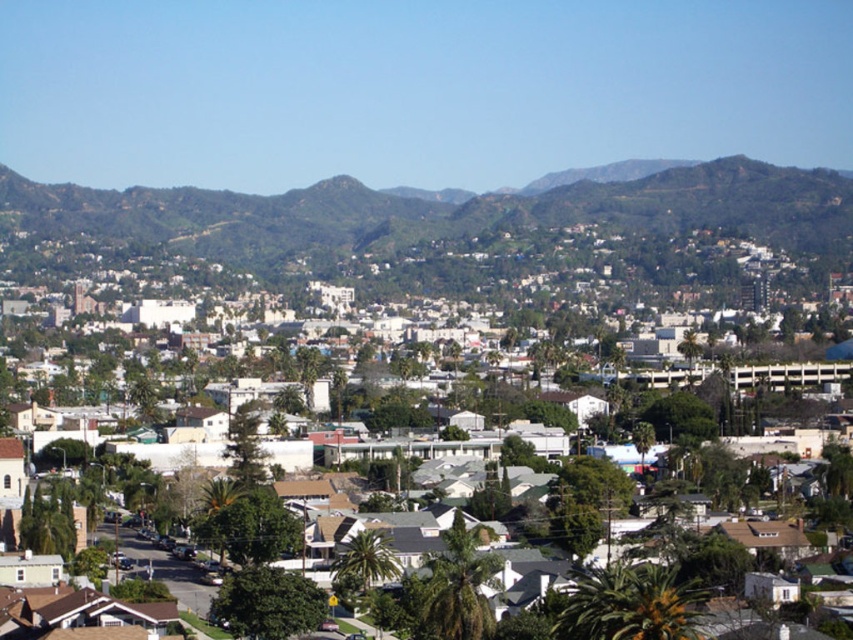
Who is positioned more to the right, white matte houses at center or green leafy palm tree at lower left?

Positioned to the right is white matte houses at center.

Does white matte houses at center lie in front of green leafy palm tree at lower left?

No, it is behind green leafy palm tree at lower left.

Is point (454, 397) closer to viewer compared to point (233, 496)?

No, it is behind (233, 496).

Locate an element on the screen. white matte houses at center is located at coordinates pyautogui.click(x=679, y=416).

Consider the image. Can you confirm if green textured hillside at upper center is smaller than green leafy palm tree at lower left?

No.

From the picture: Is green textured hillside at upper center to the left of green leafy palm tree at lower left from the viewer's perspective?

A: In fact, green textured hillside at upper center is to the right of green leafy palm tree at lower left.

Locate an element on the screen. This screenshot has height=640, width=853. green textured hillside at upper center is located at coordinates (440, 212).

At what (x,y) coordinates should I click in order to perform the action: click on green textured hillside at upper center. Please return your answer as a coordinate pair (x, y). This screenshot has height=640, width=853. Looking at the image, I should click on [x=440, y=212].

From the picture: Can you confirm if green textured hillside at upper center is wider than white matte houses at center?

Indeed, green textured hillside at upper center has a greater width compared to white matte houses at center.

Between green textured hillside at upper center and white matte houses at center, which one is positioned higher?

green textured hillside at upper center is higher up.

Where is `green textured hillside at upper center`? green textured hillside at upper center is located at coordinates (440, 212).

The height and width of the screenshot is (640, 853). I want to click on green textured hillside at upper center, so pyautogui.click(x=440, y=212).